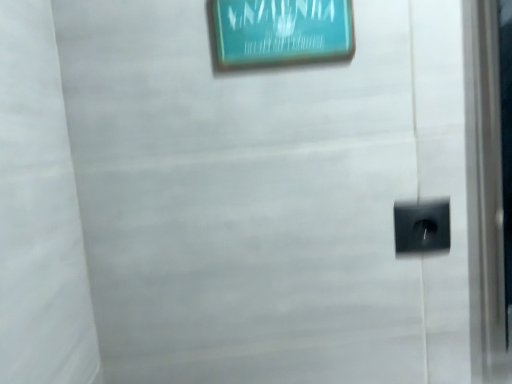
Question: Would you say teal glossy picture frame at upper center is outside black plastic electric outlet at lower right?

Choices:
 (A) no
 (B) yes

Answer: (B)

Question: Considering the relative sizes of teal glossy picture frame at upper center and black plastic electric outlet at lower right in the image provided, is teal glossy picture frame at upper center smaller than black plastic electric outlet at lower right?

Choices:
 (A) no
 (B) yes

Answer: (A)

Question: Can you confirm if teal glossy picture frame at upper center is shorter than black plastic electric outlet at lower right?

Choices:
 (A) no
 (B) yes

Answer: (A)

Question: Considering the relative positions of teal glossy picture frame at upper center and black plastic electric outlet at lower right in the image provided, is teal glossy picture frame at upper center to the right of black plastic electric outlet at lower right from the viewer's perspective?

Choices:
 (A) yes
 (B) no

Answer: (B)

Question: Is teal glossy picture frame at upper center in front of black plastic electric outlet at lower right?

Choices:
 (A) no
 (B) yes

Answer: (B)

Question: Does teal glossy picture frame at upper center touch black plastic electric outlet at lower right?

Choices:
 (A) no
 (B) yes

Answer: (A)

Question: From a real-world perspective, is black plastic electric outlet at lower right physically above teal glossy picture frame at upper center?

Choices:
 (A) no
 (B) yes

Answer: (A)

Question: Is black plastic electric outlet at lower right not inside teal glossy picture frame at upper center?

Choices:
 (A) yes
 (B) no

Answer: (A)

Question: Is black plastic electric outlet at lower right positioned before teal glossy picture frame at upper center?

Choices:
 (A) yes
 (B) no

Answer: (B)

Question: Can you confirm if black plastic electric outlet at lower right is bigger than teal glossy picture frame at upper center?

Choices:
 (A) no
 (B) yes

Answer: (A)

Question: From the image's perspective, is black plastic electric outlet at lower right on top of teal glossy picture frame at upper center?

Choices:
 (A) no
 (B) yes

Answer: (A)

Question: Can you confirm if black plastic electric outlet at lower right is positioned to the left of teal glossy picture frame at upper center?

Choices:
 (A) yes
 (B) no

Answer: (B)

Question: Is teal glossy picture frame at upper center to the left or to the right of black plastic electric outlet at lower right in the image?

Choices:
 (A) left
 (B) right

Answer: (A)